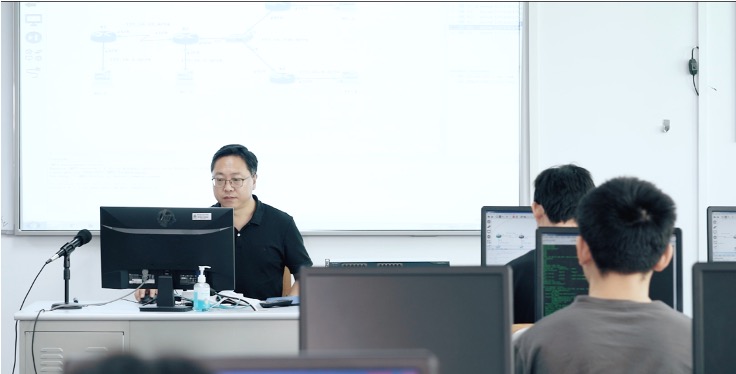
Image resolution: width=736 pixels, height=374 pixels. What are the coordinates of `computer screen` in the screenshot? It's located at (555, 260), (511, 222).